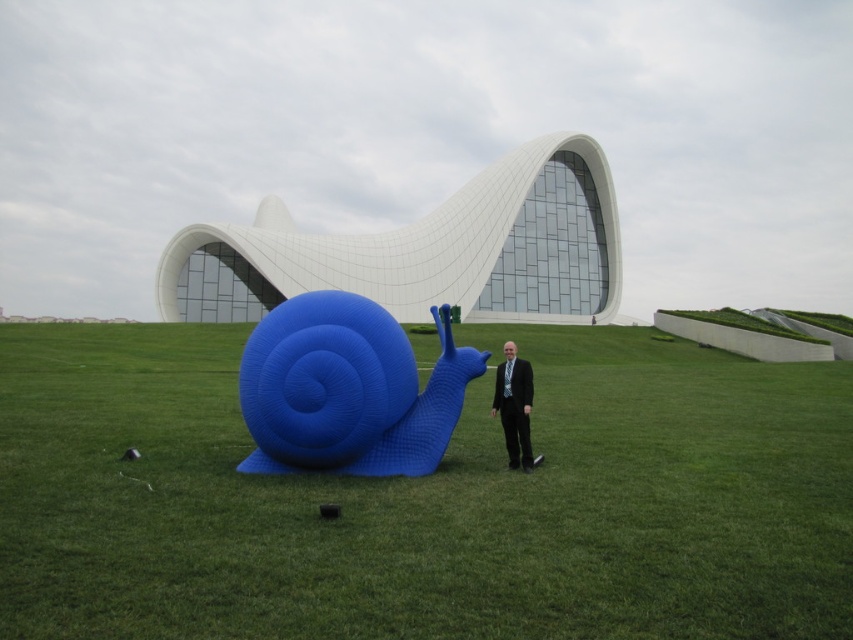
You are standing at the point closest to the snail sculpture. Which of the two points, point (x=91, y=632) or point (x=461, y=349), is closer to you?

Point (x=91, y=632) is closer to you because it is in front of point (x=461, y=349).